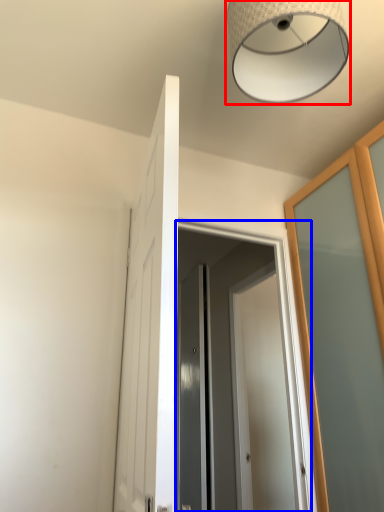
Question: Which object appears farthest to the camera in this image, lamp (highlighted by a red box) or screen door (highlighted by a blue box)?

Choices:
 (A) lamp
 (B) screen door

Answer: (B)